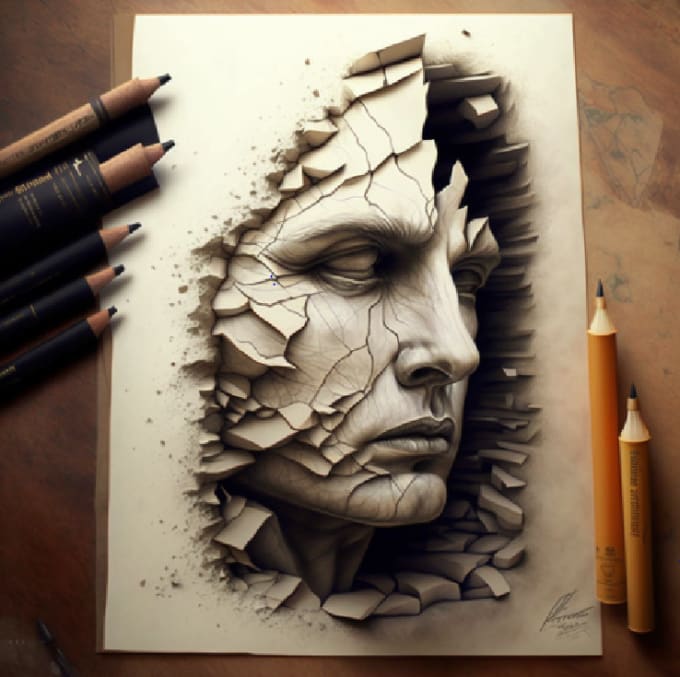
This screenshot has width=680, height=677. What are the coordinates of `hand sharpened pencils on lower right corner` in the screenshot? It's located at (638, 517).